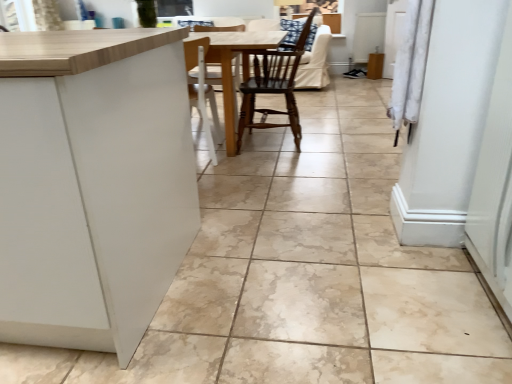
Locate an element on the screen. free spot to the right of wooden chair at center is located at coordinates (332, 139).